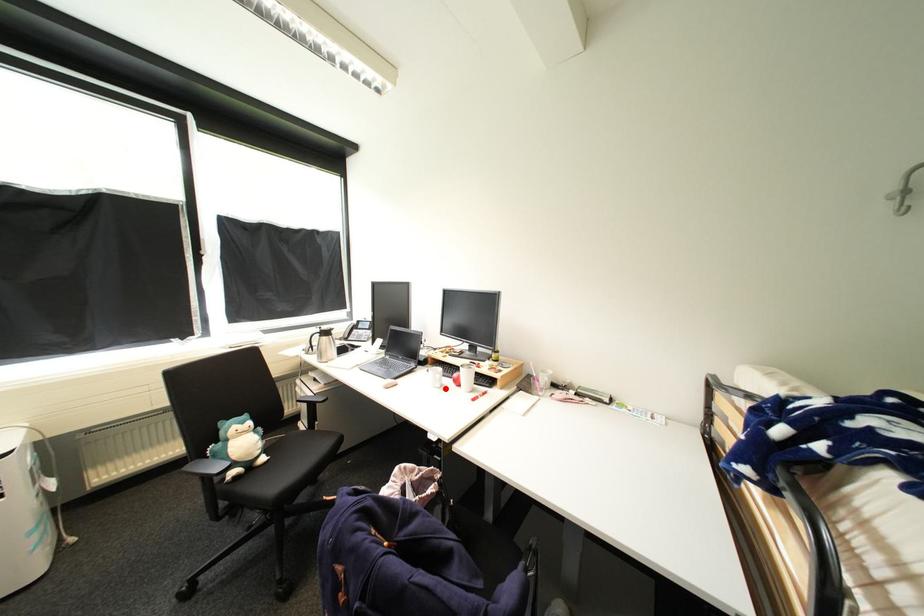
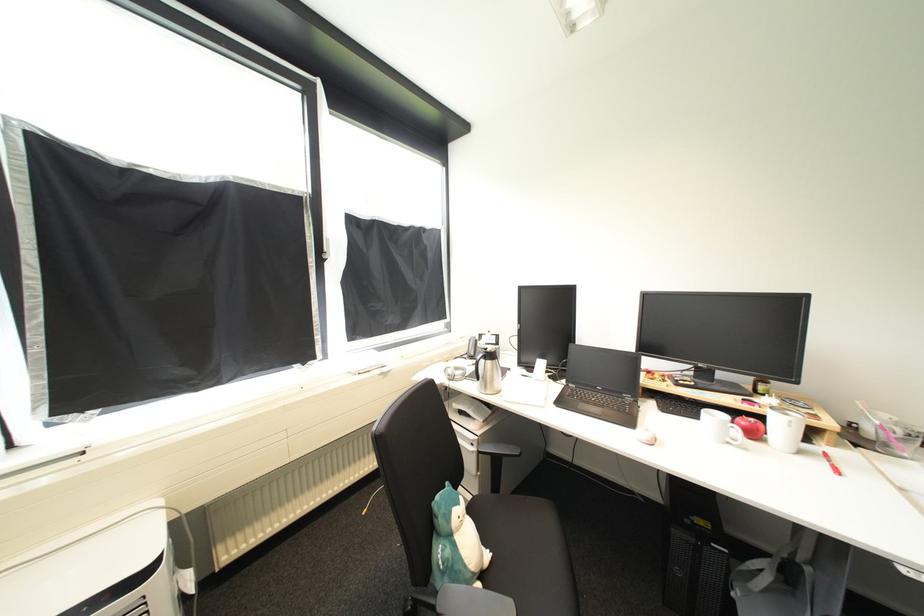
Find the pixel in the second image that matches the highlighted location in the first image.

(736, 445)